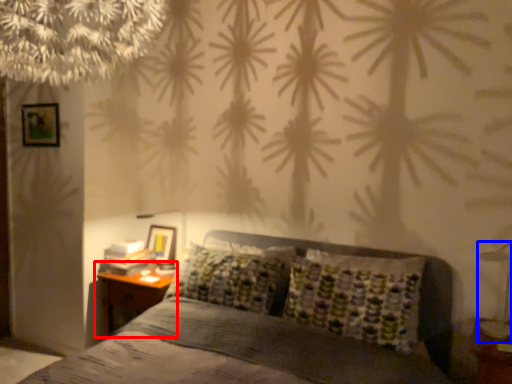
Question: Which object is closer to the camera taking this photo, nightstand (highlighted by a red box) or bedside lamp (highlighted by a blue box)?

Choices:
 (A) nightstand
 (B) bedside lamp

Answer: (B)